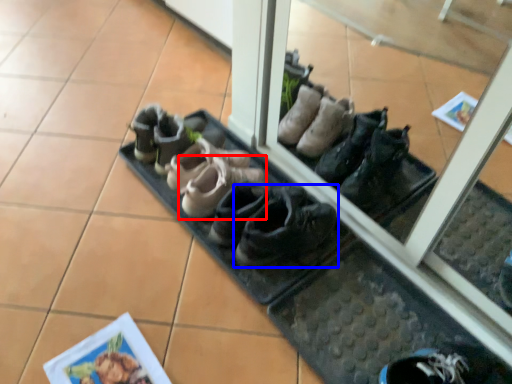
Question: Which of the following is the farthest to the observer, footwear (highlighted by a red box) or footwear (highlighted by a blue box)?

Choices:
 (A) footwear
 (B) footwear

Answer: (A)